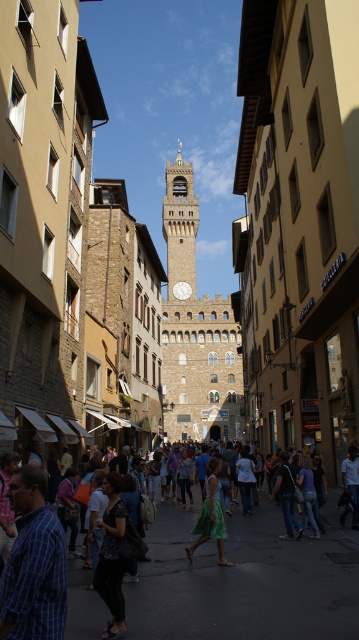
What do you see at coordinates (196, 330) in the screenshot?
I see `stone clock tower at center` at bounding box center [196, 330].

You are a GUI agent. You are given a task and a screenshot of the screen. Output one action in this format:
    pyautogui.click(x=<x>, y=<y>)
    Task: Click on the stone clock tower at center
    The image size is (359, 640).
    Given the screenshot: What is the action you would take?
    pyautogui.click(x=196, y=330)

Who is taller, green dress at center or stone clock tower at center?

Standing taller between the two is stone clock tower at center.

Between green dress at center and stone clock tower at center, which one appears on the left side from the viewer's perspective?

Positioned to the left is stone clock tower at center.

Which is behind, point (127, 604) or point (221, 433)?

The point (221, 433) is behind.

Identify the location of green dress at center. The image size is (359, 640). (244, 580).

Is point (225, 593) positioned after point (66, 573)?

Yes, point (225, 593) is farther from viewer.

Which is more to the left, green dress at center or blue plaid shirt at lower left?

Positioned to the left is blue plaid shirt at lower left.

You are a GUI agent. You are given a task and a screenshot of the screen. Output one action in this format:
    pyautogui.click(x=<x>, y=<y>)
    Task: Click on the green dress at center
    The height and width of the screenshot is (640, 359).
    Given the screenshot: What is the action you would take?
    pyautogui.click(x=244, y=580)